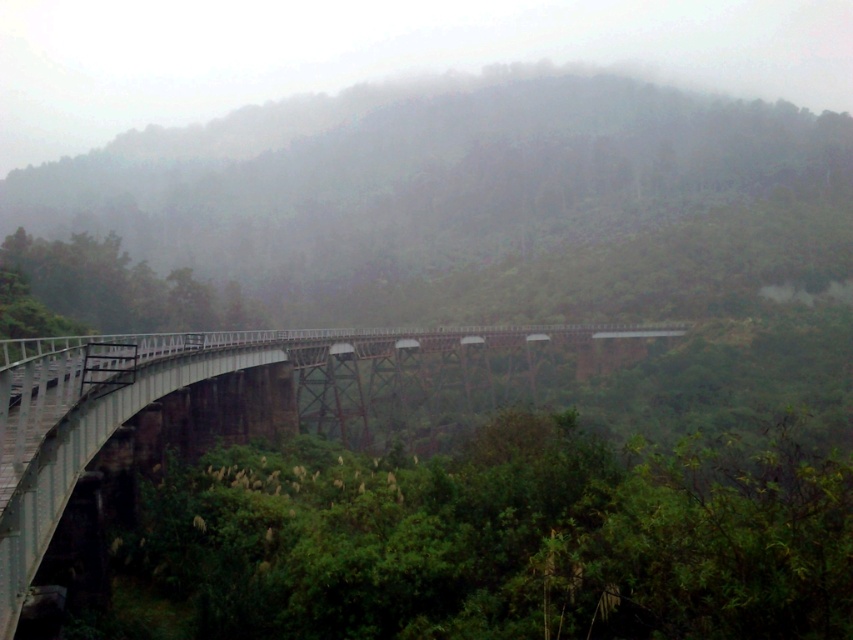
Consider the image. Is foggy forest at center thinner than white metallic bridge at lower left?

No.

Is point (395, 180) farther from camera compared to point (41, 392)?

That is True.

Where is `foggy forest at center`? foggy forest at center is located at coordinates (474, 202).